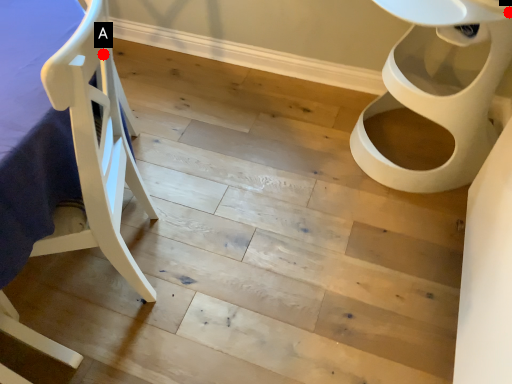
Question: Two points are circled on the image, labeled by A and B beside each circle. Among these points, which one is farthest from the camera?

Choices:
 (A) A is further
 (B) B is further

Answer: (B)